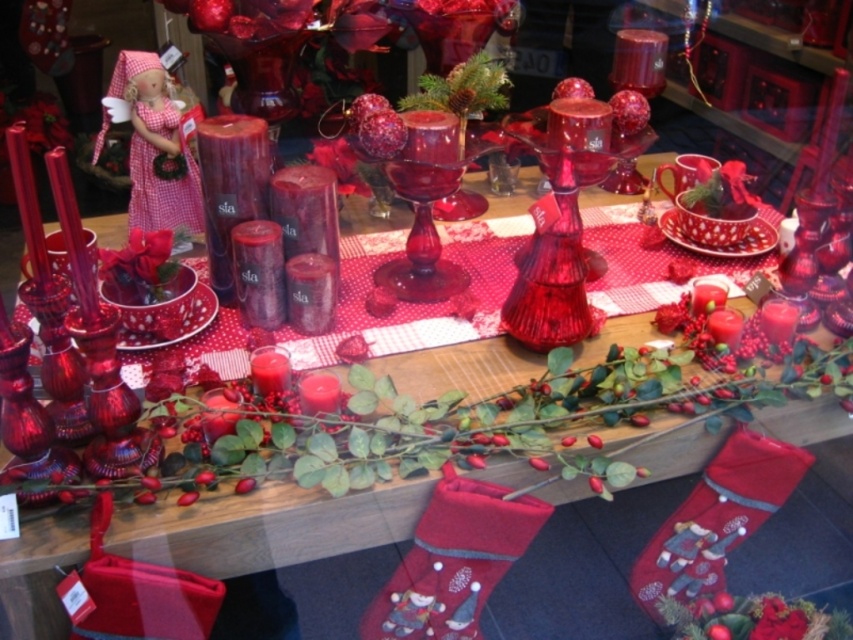
Question: Is velvet red stocking at lower right further to camera compared to pink gingham doll at upper left?

Choices:
 (A) no
 (B) yes

Answer: (A)

Question: Which point is closer to the camera?

Choices:
 (A) velvet red stocking at lower right
 (B) pink gingham doll at upper left

Answer: (A)

Question: Which object is closer to the camera taking this photo?

Choices:
 (A) velvet red stocking at lower right
 (B) pink gingham doll at upper left

Answer: (A)

Question: Which object appears farthest from the camera in this image?

Choices:
 (A) pink gingham doll at upper left
 (B) velvet red stocking at lower right

Answer: (A)

Question: Observing the image, what is the correct spatial positioning of velvet red stocking at lower right in reference to pink gingham doll at upper left?

Choices:
 (A) right
 (B) left

Answer: (A)

Question: Is velvet red stocking at lower right to the left of pink gingham doll at upper left from the viewer's perspective?

Choices:
 (A) yes
 (B) no

Answer: (B)